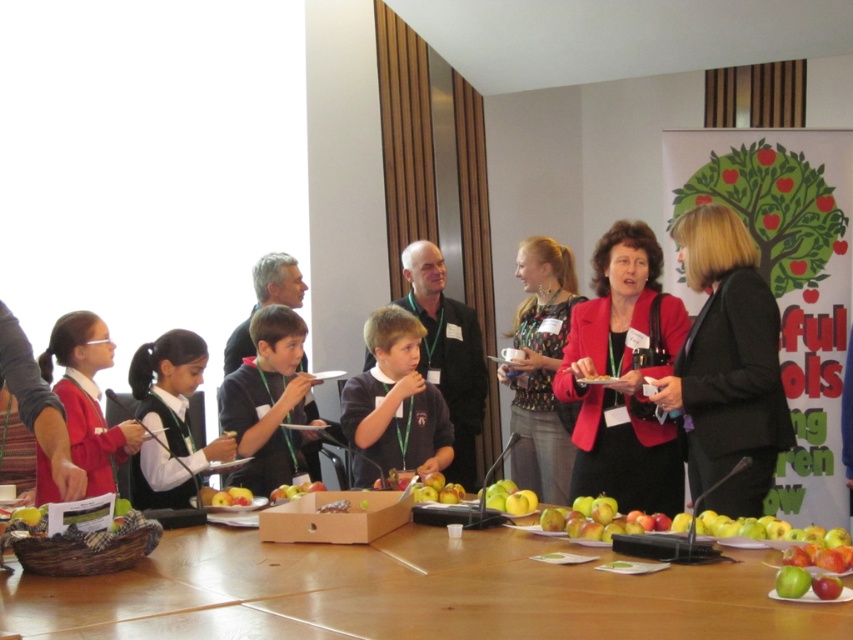
Is point (170, 499) positioned behind point (416, 252)?

No, it is in front of (416, 252).

Is white uniform at center to the left of dark gray shirt at center from the viewer's perspective?

Yes, white uniform at center is to the left of dark gray shirt at center.

Between point (131, 493) and point (476, 419), which one is positioned in front?

Positioned in front is point (131, 493).

Find the location of a particular element. This screenshot has width=853, height=640. white uniform at center is located at coordinates (169, 420).

Does black fabric jacket at center lie behind matte red sweater at left?

Yes, it is behind matte red sweater at left.

Between black fabric jacket at center and matte red sweater at left, which one has more height?

black fabric jacket at center

What do you see at coordinates (727, 364) in the screenshot? The height and width of the screenshot is (640, 853). I see `black fabric jacket at center` at bounding box center [727, 364].

At what (x,y) coordinates should I click in order to perform the action: click on black fabric jacket at center. Please return your answer as a coordinate pair (x, y). Looking at the image, I should click on (727, 364).

Is wooden table at center below matte black shirt at center?

Correct, wooden table at center is located below matte black shirt at center.

Which is in front, point (265, 547) or point (299, 472)?

Point (265, 547) is more forward.

Which is behind, point (607, 627) or point (258, 442)?

Positioned behind is point (258, 442).

Image resolution: width=853 pixels, height=640 pixels. I want to click on wooden table at center, so click(x=405, y=593).